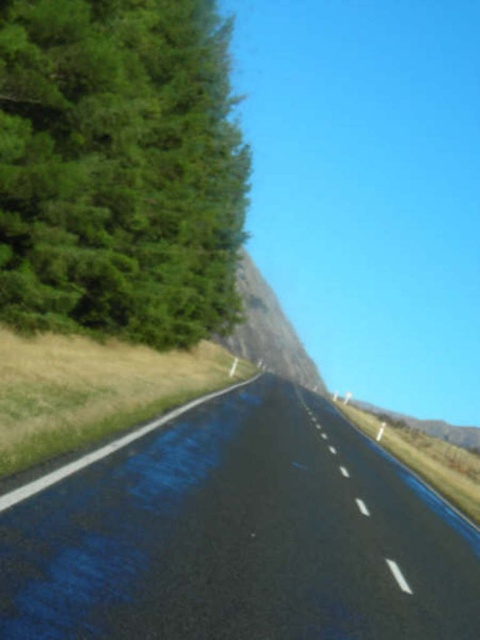
Is black asphalt road at center bigger than green leafy tree at left?

Incorrect, black asphalt road at center is not larger than green leafy tree at left.

Between point (88, 522) and point (137, 234), which one is positioned in front?

Point (88, 522)

Identify the location of black asphalt road at center. The height and width of the screenshot is (640, 480). (240, 536).